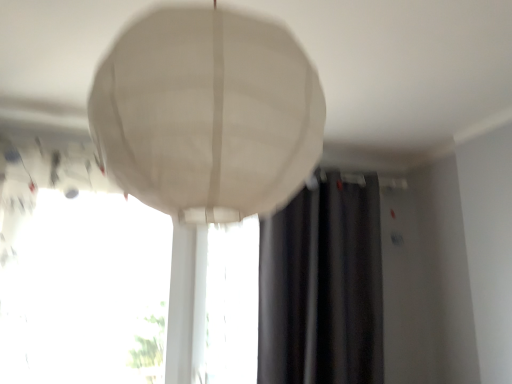
Question: Which direction should I rotate to face transparent glass window at center, the second window when ordered from left to right, — up or down?

Choices:
 (A) down
 (B) up

Answer: (A)

Question: Should I look upward or downward to see white fabric lampshade at center?

Choices:
 (A) down
 (B) up

Answer: (B)

Question: From the image's perspective, is white fabric lampshade at center over transparent glass window at center, which ranks as the first window in left-to-right order?

Choices:
 (A) yes
 (B) no

Answer: (A)

Question: Can you confirm if white fabric lampshade at center is thinner than transparent glass window at center, which ranks as the second window in right-to-left order?

Choices:
 (A) no
 (B) yes

Answer: (A)

Question: From a real-world perspective, is white fabric lampshade at center on top of transparent glass window at center, which ranks as the second window in right-to-left order?

Choices:
 (A) yes
 (B) no

Answer: (A)

Question: Is white fabric lampshade at center aimed at transparent glass window at center, which ranks as the second window in right-to-left order?

Choices:
 (A) no
 (B) yes

Answer: (A)

Question: Is white fabric lampshade at center with transparent glass window at center, which ranks as the second window in right-to-left order?

Choices:
 (A) no
 (B) yes

Answer: (A)

Question: Is the position of white fabric lampshade at center less distant than that of transparent glass window at center, which ranks as the first window in left-to-right order?

Choices:
 (A) yes
 (B) no

Answer: (A)

Question: Does dark gray fabric curtain at center have a greater width compared to white fabric lampshade at center?

Choices:
 (A) yes
 (B) no

Answer: (B)

Question: Considering the relative sizes of dark gray fabric curtain at center and white fabric lampshade at center in the image provided, is dark gray fabric curtain at center taller than white fabric lampshade at center?

Choices:
 (A) yes
 (B) no

Answer: (A)

Question: Is dark gray fabric curtain at center oriented towards white fabric lampshade at center?

Choices:
 (A) yes
 (B) no

Answer: (A)

Question: Is dark gray fabric curtain at center to the left of white fabric lampshade at center from the viewer's perspective?

Choices:
 (A) no
 (B) yes

Answer: (A)

Question: Considering the relative sizes of dark gray fabric curtain at center and white fabric lampshade at center in the image provided, is dark gray fabric curtain at center thinner than white fabric lampshade at center?

Choices:
 (A) no
 (B) yes

Answer: (B)

Question: Does dark gray fabric curtain at center appear on the right side of white fabric lampshade at center?

Choices:
 (A) yes
 (B) no

Answer: (A)

Question: Would you say dark gray fabric curtain at center is outside transparent glass window at center, the first window from the right?

Choices:
 (A) no
 (B) yes

Answer: (B)